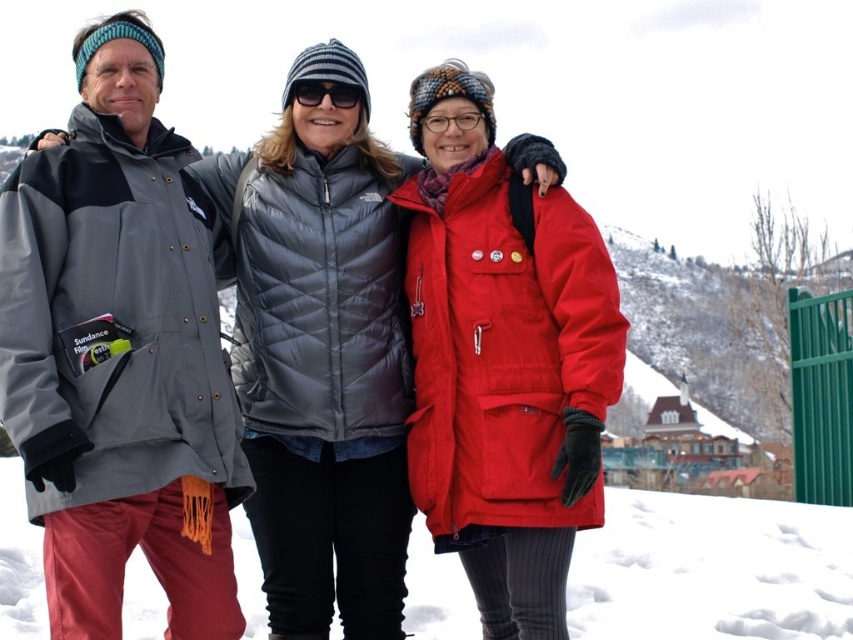
Locate an element on the screen. The image size is (853, 640). matte gray puffer jacket at center is located at coordinates (209, 352).

Who is more forward, (335, 368) or (289, 93)?

Point (335, 368)

Between point (103, 132) and point (296, 92), which one is positioned behind?

Positioned behind is point (296, 92).

Image resolution: width=853 pixels, height=640 pixels. What are the coordinates of `matte gray puffer jacket at center` in the screenshot? It's located at (209, 352).

Does gray matte jacket at left have a lesser height compared to white snow at lower center?

In fact, gray matte jacket at left may be taller than white snow at lower center.

Does gray matte jacket at left have a larger size compared to white snow at lower center?

No, gray matte jacket at left is not bigger than white snow at lower center.

Between point (28, 436) and point (614, 499), which one is positioned behind?

Positioned behind is point (614, 499).

Where is `gray matte jacket at left`? The image size is (853, 640). gray matte jacket at left is located at coordinates (119, 353).

Identify the location of white snow at lower center. (711, 570).

Who is more distant from viewer, (624,636) or (338,88)?

Positioned behind is point (624,636).

Is point (590, 600) more distant than point (344, 104)?

Yes, point (590, 600) is behind point (344, 104).

Identify the location of white snow at lower center. coord(711,570).